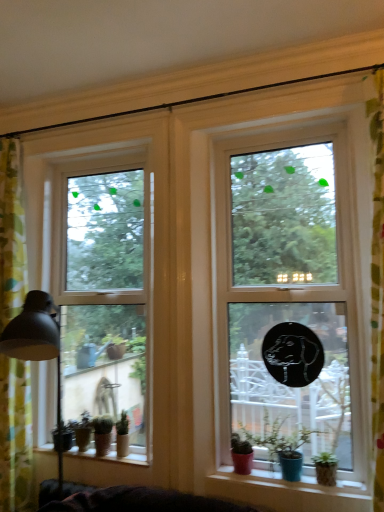
Image resolution: width=384 pixels, height=512 pixels. I want to click on empty space that is ontop of transparent glass window at center, which ranks as the 2th window in left-to-right order (from a real-world perspective), so click(276, 128).